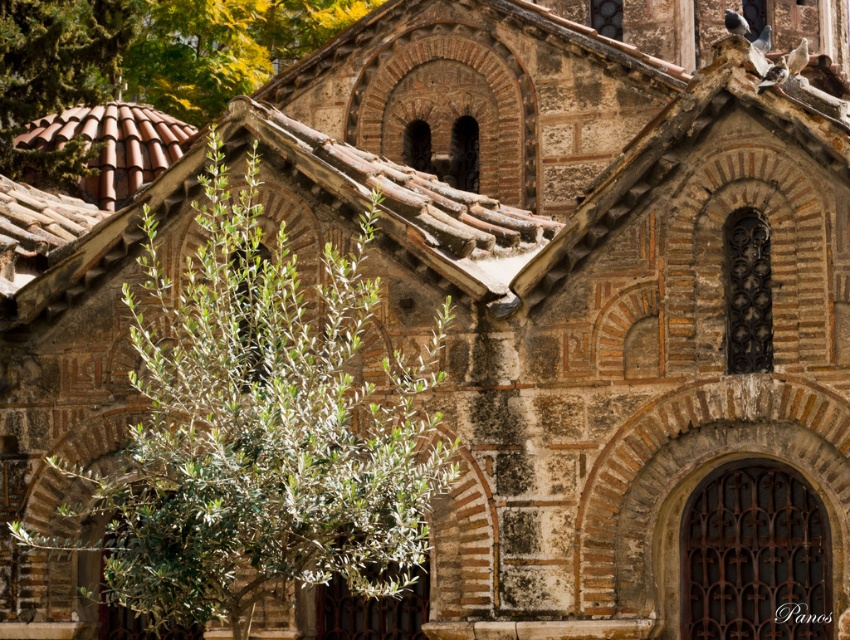
You are standing in front of the ancient stone building and want to take a photo of the entire facade without any obstruction. The green leafy plant at left is blocking part of the view. Based on its 2D location, can you estimate whether the plant is positioned to the left or right side of the building?

The green leafy plant at left is located at point 0.673 on the x axis and 0.305 on the y axis. Since the x coordinate is 0.673, which is closer to 1.0, this means the plant is positioned to the right side of the building.